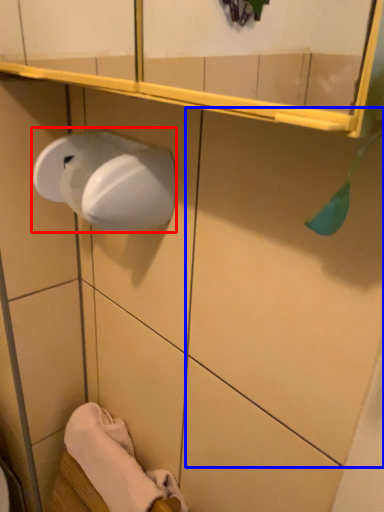
Question: Which object appears closest to the camera in this image, paper towel (highlighted by a red box) or tile (highlighted by a blue box)?

Choices:
 (A) paper towel
 (B) tile

Answer: (B)